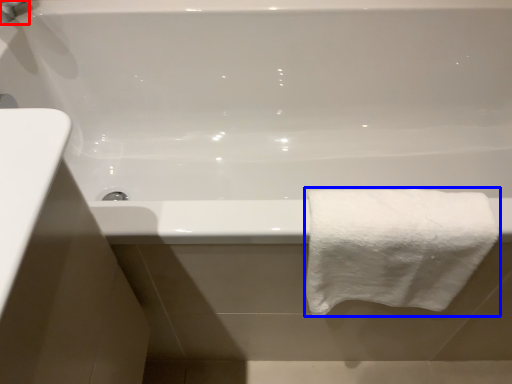
Question: Among these objects, which one is nearest to the camera, faucet (highlighted by a red box) or towel (highlighted by a blue box)?

Choices:
 (A) faucet
 (B) towel

Answer: (B)